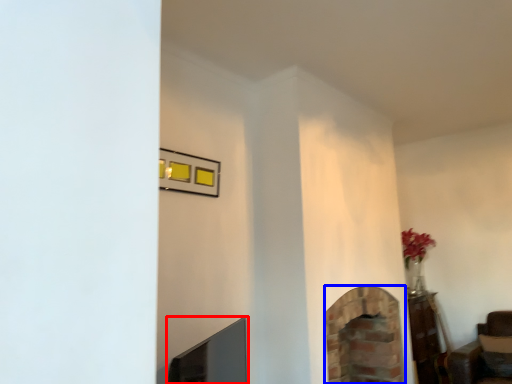
Question: Among these objects, which one is nearest to the camera, fireplace (highlighted by a red box) or fireplace (highlighted by a blue box)?

Choices:
 (A) fireplace
 (B) fireplace

Answer: (A)